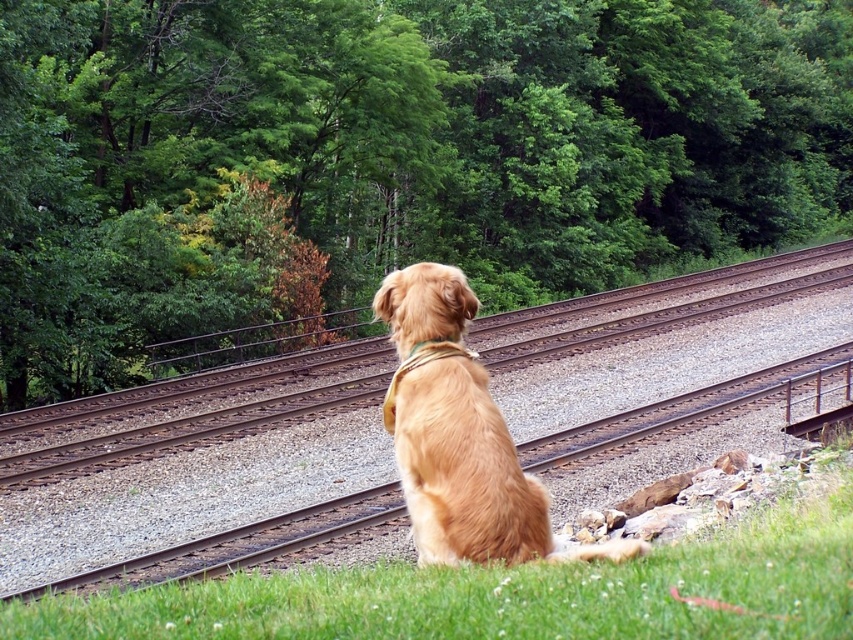
You are a dog owner who wants to let your dog play safely. Based on the scene, which area would be better for the dog to play in, the brown metal train track at center or the green soft grass at lower center? Explain your reasoning using the objects provided.

The green soft grass at lower center is better for the dog to play in because the brown metal train track at center is positioned over it, indicating the grass is a safer and more comfortable surface for the dog.